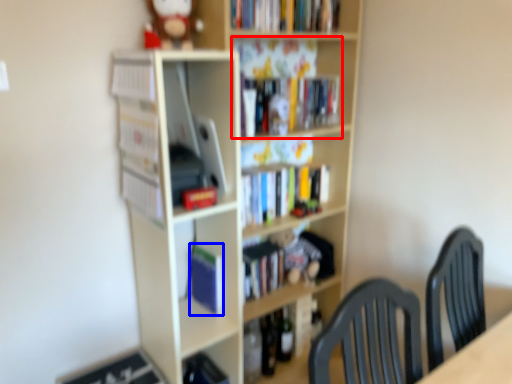
Question: Which object appears farthest to the camera in this image, book (highlighted by a red box) or paperback book (highlighted by a blue box)?

Choices:
 (A) book
 (B) paperback book

Answer: (B)